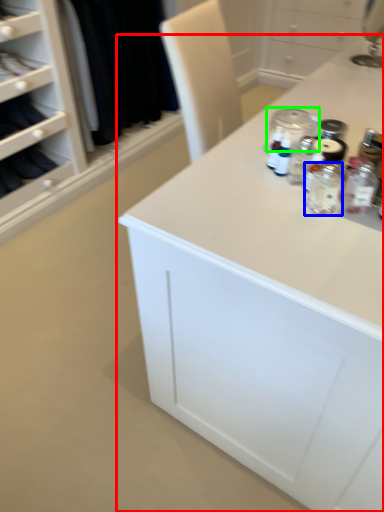
Question: Which object is positioned closest to countertop (highlighted by a red box)? Select from bottle (highlighted by a blue box) and glass jar (highlighted by a green box).

Choices:
 (A) bottle
 (B) glass jar

Answer: (A)